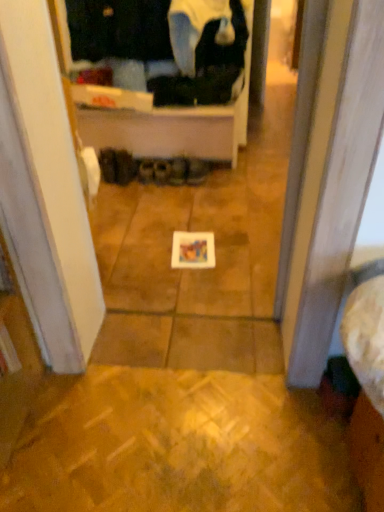
At what (x,y) coordinates should I click in order to perform the action: click on free spot to the right of leather brown shoes at center, which is counted as the first footwear, starting from the right. Please return your answer as a coordinate pair (x, y). Looking at the image, I should click on (229, 179).